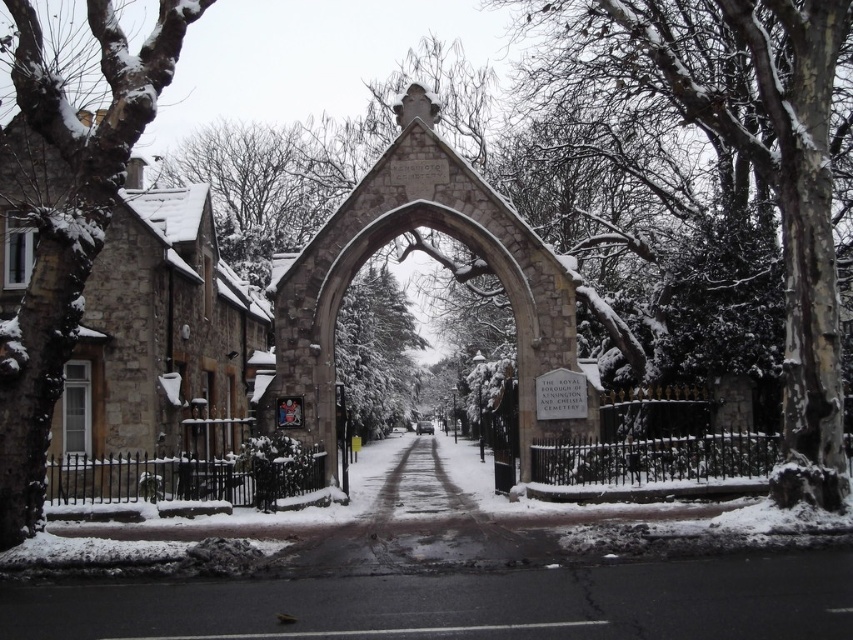
Question: Is snow-covered bark at center wider than snow-covered bark at left?

Choices:
 (A) yes
 (B) no

Answer: (A)

Question: Which of the following is the closest to the observer?

Choices:
 (A) snow-covered bark at left
 (B) snow-covered bark at center

Answer: (A)

Question: Is snow-covered bark at center to the right of snow-covered bark at left from the viewer's perspective?

Choices:
 (A) no
 (B) yes

Answer: (B)

Question: Is the position of snow-covered bark at center more distant than that of snow-covered bark at left?

Choices:
 (A) yes
 (B) no

Answer: (A)